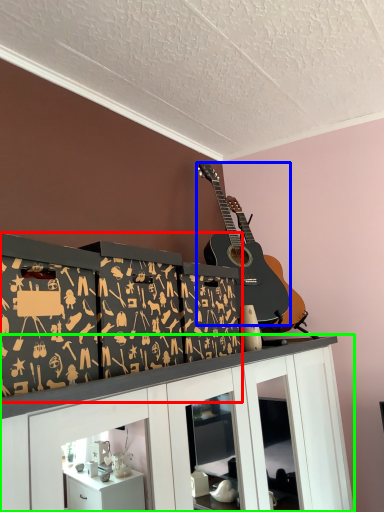
Question: Considering the real-world distances, which object is closest to shelf (highlighted by a red box)? guitar (highlighted by a blue box) or cabinetry (highlighted by a green box).

Choices:
 (A) guitar
 (B) cabinetry

Answer: (B)